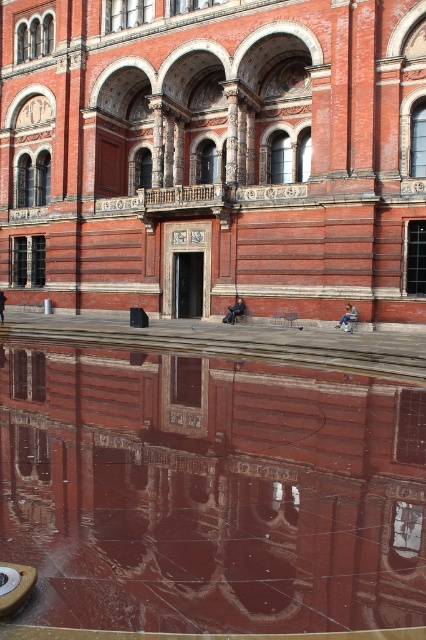
Can you confirm if smooth stone plaza at center is taller than smooth reflective water at center?

Indeed, smooth stone plaza at center has a greater height compared to smooth reflective water at center.

Is point (25, 292) positioned in front of point (400, 468)?

No, (25, 292) is further to viewer.

Locate an element on the screen. The width and height of the screenshot is (426, 640). smooth stone plaza at center is located at coordinates (215, 154).